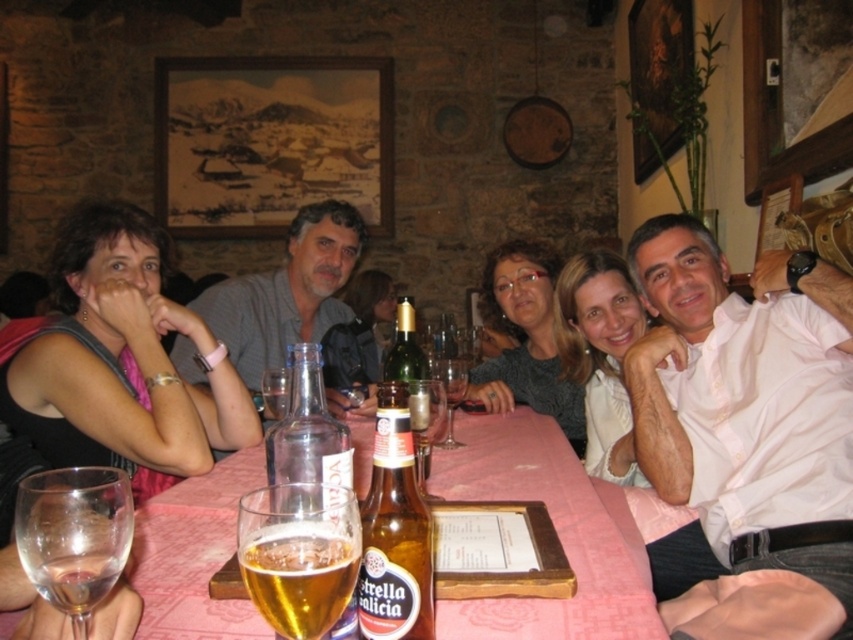
You are a server at the rustic restaurant and need to deliver a drink to the person wearing the white shirt at right. The table is 1.08 meters wide. Can you place the drink on the table without it falling off?

The table is 1.08 meters wide, so placing the drink in the center would ensure it stays within the table. The distance between the edge of the table and the white shirt at right is 0.54 meters, which is safe for placing the drink without it falling off.

You are a photographer taking a picture of the scene. You have two points marked in the image at coordinates point (300, 392) and point (285, 413). Which point is closer to the camera?

Point (300, 392) is closer to the viewer than point (285, 413).